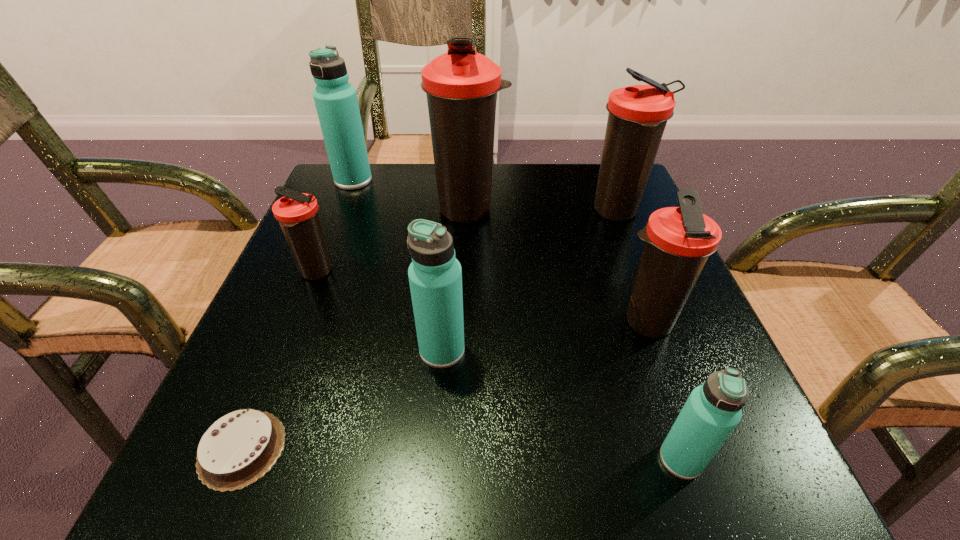
In the image, there is a desktop. At what (x,y) coordinates should I click in order to perform the action: click on free space at the left edge. Please return your answer as a coordinate pair (x, y). This screenshot has height=540, width=960. Looking at the image, I should click on (377, 226).

Locate an element on the screen. This screenshot has width=960, height=540. vacant space at the right edge of the desktop is located at coordinates (684, 366).

The height and width of the screenshot is (540, 960). In order to click on vacant region at the far left corner in this screenshot , I will do `click(325, 194)`.

The image size is (960, 540). In the image, there is a desktop. Find the location of `vacant space at the far right corner`. vacant space at the far right corner is located at coordinates (591, 193).

In the image, there is a desktop. Where is `vacant space at the near right corner`? This screenshot has width=960, height=540. vacant space at the near right corner is located at coordinates (743, 490).

I want to click on free point between the shortest object and the nearest brown thermos bottle, so click(x=444, y=386).

This screenshot has height=540, width=960. Find the location of `blank region between the second aqua thermos bottle from left to right and the farthest aqua thermos bottle`. blank region between the second aqua thermos bottle from left to right and the farthest aqua thermos bottle is located at coordinates (397, 266).

Where is `vacant region between the second biggest brown thermos bottle and the second brown thermos bottle from left to right`? This screenshot has height=540, width=960. vacant region between the second biggest brown thermos bottle and the second brown thermos bottle from left to right is located at coordinates (543, 211).

Identify the location of unoccupied position between the second aqua thermos bottle from right to left and the second smallest brown thermos bottle. (544, 337).

The image size is (960, 540). Identify the location of empty location between the nearest thermos bottle and the shortest object. pyautogui.click(x=462, y=454).